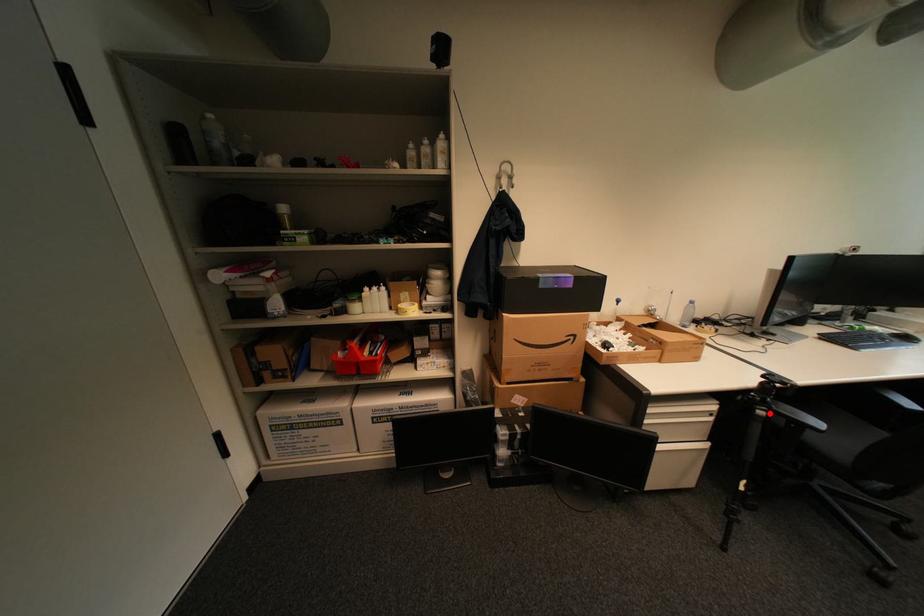
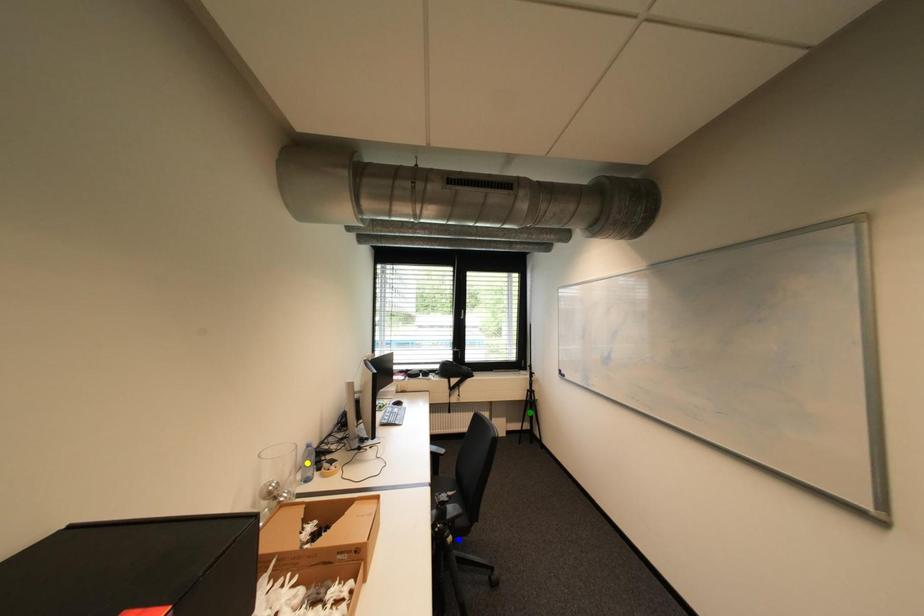
Question: I am providing you with two images of the same scene from different viewpoints. A red point is marked on the first image. You are given multiple points on the second image. Which point in image 2 represents the same 3d spot as the red point in image 1?

Choices:
 (A) green point
 (B) blue point
 (C) yellow point

Answer: (B)